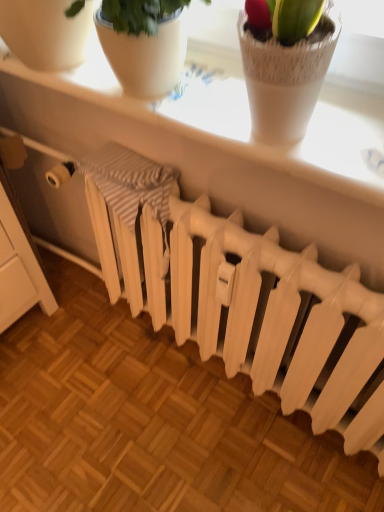
Question: Considering the positions of white textured window sill at upper center and white matte radiator at center in the image, is white textured window sill at upper center taller or shorter than white matte radiator at center?

Choices:
 (A) tall
 (B) short

Answer: (B)

Question: Based on their sizes in the image, would you say white textured window sill at upper center is bigger or smaller than white matte radiator at center?

Choices:
 (A) small
 (B) big

Answer: (A)

Question: Is white textured window sill at upper center inside the boundaries of white matte radiator at center, or outside?

Choices:
 (A) outside
 (B) inside

Answer: (A)

Question: From the image's perspective, relative to white textured window sill at upper center, is white matte radiator at center above or below?

Choices:
 (A) below
 (B) above

Answer: (A)

Question: Is white matte radiator at center in front of or behind white textured window sill at upper center in the image?

Choices:
 (A) front
 (B) behind

Answer: (B)

Question: From a real-world perspective, is white matte radiator at center positioned above or below white textured window sill at upper center?

Choices:
 (A) above
 (B) below

Answer: (B)

Question: Considering the positions of white matte radiator at center and white textured window sill at upper center in the image, is white matte radiator at center bigger or smaller than white textured window sill at upper center?

Choices:
 (A) big
 (B) small

Answer: (A)